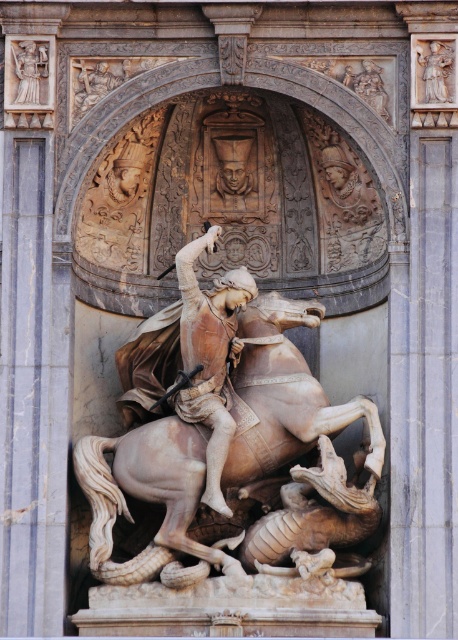
Question: Which of these objects is positioned closest to the polished bronze statue at center?

Choices:
 (A) polished marble statue at upper left
 (B) polished marble statue at upper right
 (C) polished marble figures at upper right
 (D) beige marble horse at center

Answer: (D)

Question: Does polished marble statue at upper left appear under polished marble statue at upper right?

Choices:
 (A) no
 (B) yes

Answer: (B)

Question: Which of the following is the closest to the observer?

Choices:
 (A) polished bronze statue at center
 (B) polished marble statue at upper right

Answer: (A)

Question: Estimate the real-world distances between objects in this image. Which object is closer to the beige marble horse at center?

Choices:
 (A) polished bronze statue at center
 (B) polished marble statue at upper left

Answer: (A)

Question: Does beige marble horse at center appear under polished marble statue at upper right?

Choices:
 (A) yes
 (B) no

Answer: (A)

Question: Is polished marble statue at upper right below polished marble figures at upper right?

Choices:
 (A) yes
 (B) no

Answer: (B)